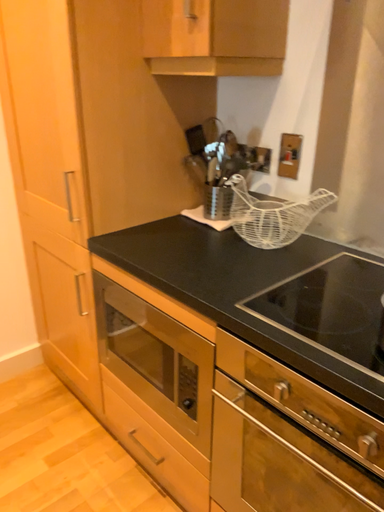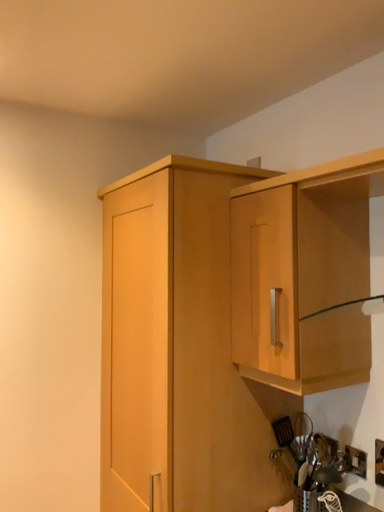
Question: Which way did the camera rotate in the video?

Choices:
 (A) rotated downward
 (B) rotated upward

Answer: (B)